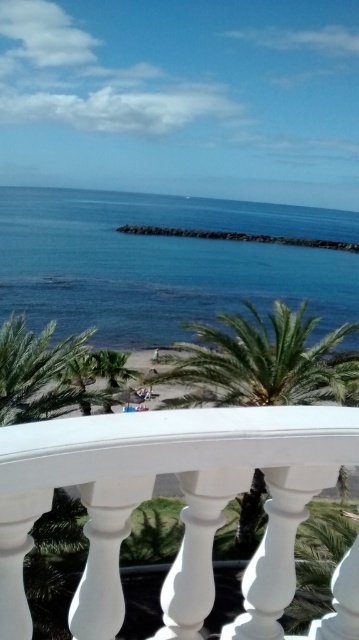
Is white glossy balustrade at lower center thinner than green leafy palm tree at center?

Correct, white glossy balustrade at lower center's width is less than green leafy palm tree at center's.

Does white glossy balustrade at lower center appear on the right side of green leafy palm tree at center?

Incorrect, white glossy balustrade at lower center is not on the right side of green leafy palm tree at center.

The width and height of the screenshot is (359, 640). What are the coordinates of `white glossy balustrade at lower center` in the screenshot? It's located at click(x=182, y=509).

Who is lower down, blue water at center or green leafy palm tree at center?

green leafy palm tree at center is below.

Can you confirm if blue water at center is shorter than green leafy palm tree at center?

No.

Which is in front, point (315, 284) or point (202, 358)?

Point (202, 358)

Where is `blue water at center`? blue water at center is located at coordinates (162, 262).

Between white glossy balustrade at lower center and blue water at center, which one appears on the left side from the viewer's perspective?

blue water at center

Does white glossy balustrade at lower center have a greater width compared to blue water at center?

No, white glossy balustrade at lower center is not wider than blue water at center.

Image resolution: width=359 pixels, height=640 pixels. Describe the element at coordinates (182, 509) in the screenshot. I see `white glossy balustrade at lower center` at that location.

Where is `white glossy balustrade at lower center`? white glossy balustrade at lower center is located at coordinates (182, 509).